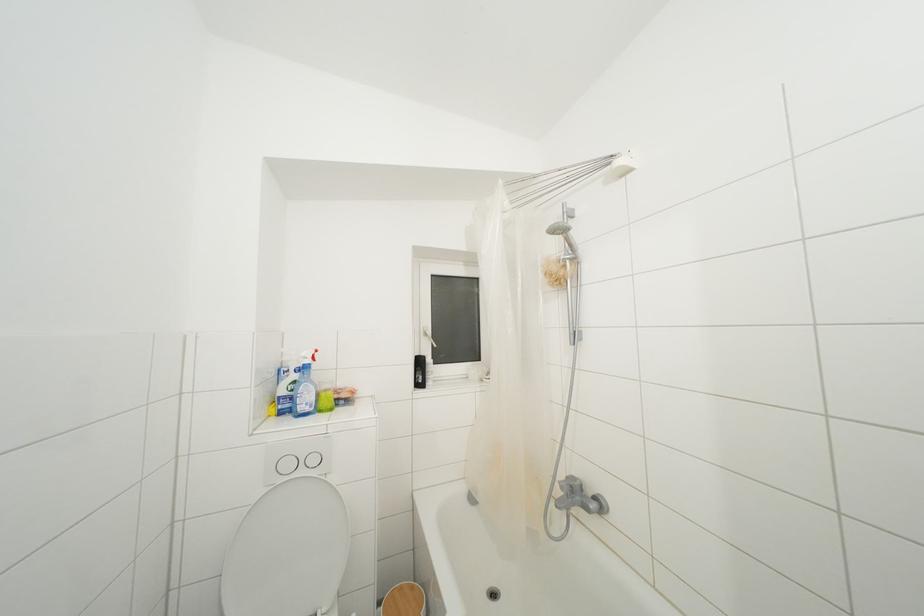
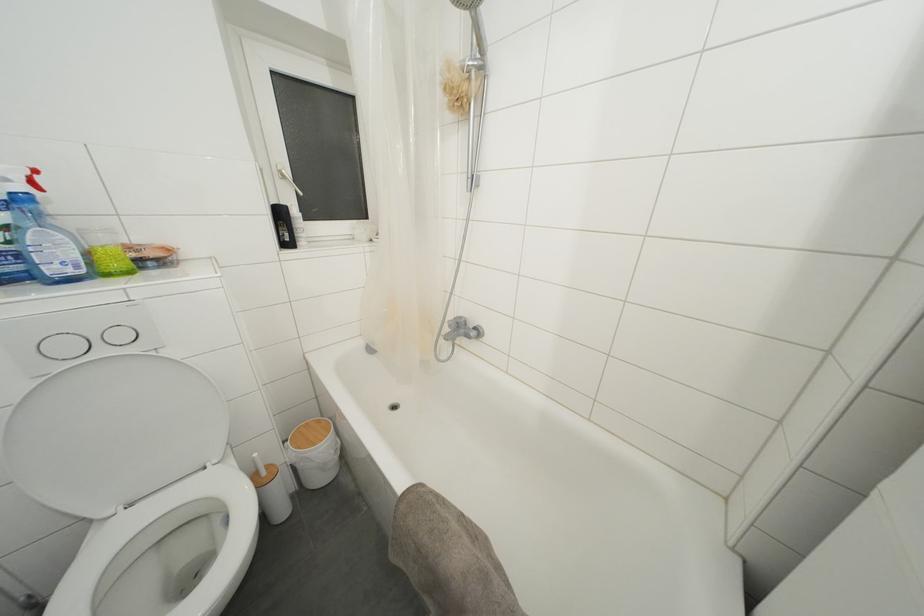
Where in the second image is the point corresponding to the point at 331,391 from the first image?

(108, 245)